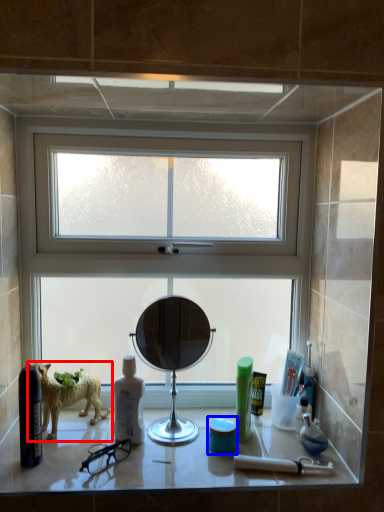
Question: Which object appears farthest to the camera in this image, dog (highlighted by a red box) or mouthwash (highlighted by a blue box)?

Choices:
 (A) dog
 (B) mouthwash

Answer: (A)